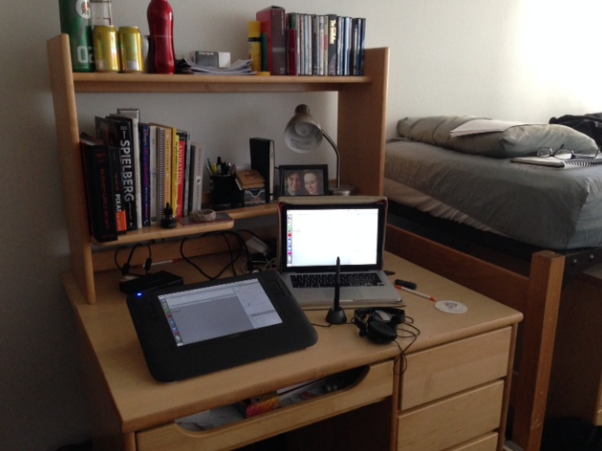
The image size is (602, 451). Find the location of `book`. book is located at coordinates (146, 199).